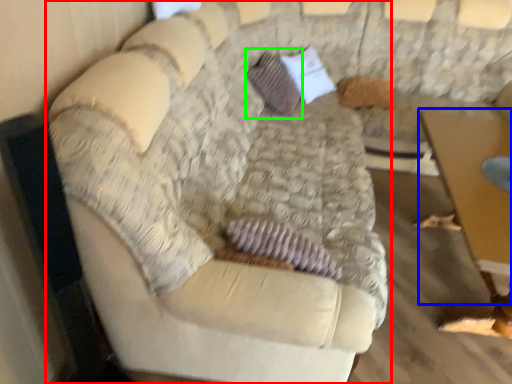
Question: Which is nearer to the studio couch (highlighted by a red box)? table (highlighted by a blue box) or pillow (highlighted by a green box).

Choices:
 (A) table
 (B) pillow

Answer: (A)